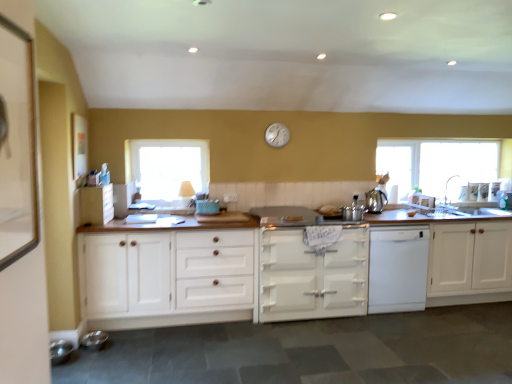
Question: Which direction should I rotate to look at white painted wood stove at center, which is the second cabinetry in right-to-left order?

Choices:
 (A) right
 (B) left

Answer: (A)

Question: Is white matte dishwasher at center not near white enamel gas stove at center?

Choices:
 (A) yes
 (B) no

Answer: (B)

Question: Would you say white matte dishwasher at center is outside white enamel gas stove at center?

Choices:
 (A) no
 (B) yes

Answer: (B)

Question: Is white matte dishwasher at center closer to camera compared to white enamel gas stove at center?

Choices:
 (A) no
 (B) yes

Answer: (A)

Question: From the image's perspective, is white matte dishwasher at center on top of white enamel gas stove at center?

Choices:
 (A) yes
 (B) no

Answer: (B)

Question: From a real-world perspective, is white matte dishwasher at center located higher than white enamel gas stove at center?

Choices:
 (A) no
 (B) yes

Answer: (A)

Question: Is white matte dishwasher at center beside white enamel gas stove at center?

Choices:
 (A) no
 (B) yes

Answer: (A)

Question: Is white wood cabinet at center, which is counted as the 2th cabinetry, starting from the left, facing towards white wood cabinet at left, acting as the 1th cabinetry starting from the left?

Choices:
 (A) yes
 (B) no

Answer: (B)

Question: Is white wood cabinet at center, the third cabinetry when ordered from right to left, placed right next to white wood cabinet at left, placed as the fourth cabinetry when sorted from right to left?

Choices:
 (A) yes
 (B) no

Answer: (B)

Question: Is white wood cabinet at left, acting as the 1th cabinetry starting from the left, completely or partially inside white wood cabinet at center, the third cabinetry when ordered from right to left?

Choices:
 (A) no
 (B) yes

Answer: (A)

Question: Is white wood cabinet at center, the third cabinetry when ordered from right to left, shorter than white wood cabinet at left, placed as the fourth cabinetry when sorted from right to left?

Choices:
 (A) yes
 (B) no

Answer: (B)

Question: Can you confirm if white wood cabinet at center, which is counted as the 2th cabinetry, starting from the left, is bigger than white wood cabinet at left, acting as the 1th cabinetry starting from the left?

Choices:
 (A) yes
 (B) no

Answer: (A)

Question: Is white wood cabinet at center, which is counted as the 2th cabinetry, starting from the left, not within white wood cabinet at left, acting as the 1th cabinetry starting from the left?

Choices:
 (A) no
 (B) yes

Answer: (B)

Question: From the image's perspective, would you say white wood cabinet at center, the third cabinetry when ordered from right to left, is positioned over metallic silver pots at center, which is the first appliance in right-to-left order?

Choices:
 (A) yes
 (B) no

Answer: (B)